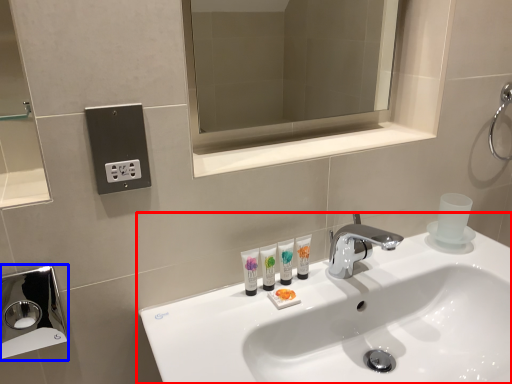
Question: Which object appears farthest to the camera in this image, sink (highlighted by a red box) or hand dryer (highlighted by a blue box)?

Choices:
 (A) sink
 (B) hand dryer

Answer: (B)